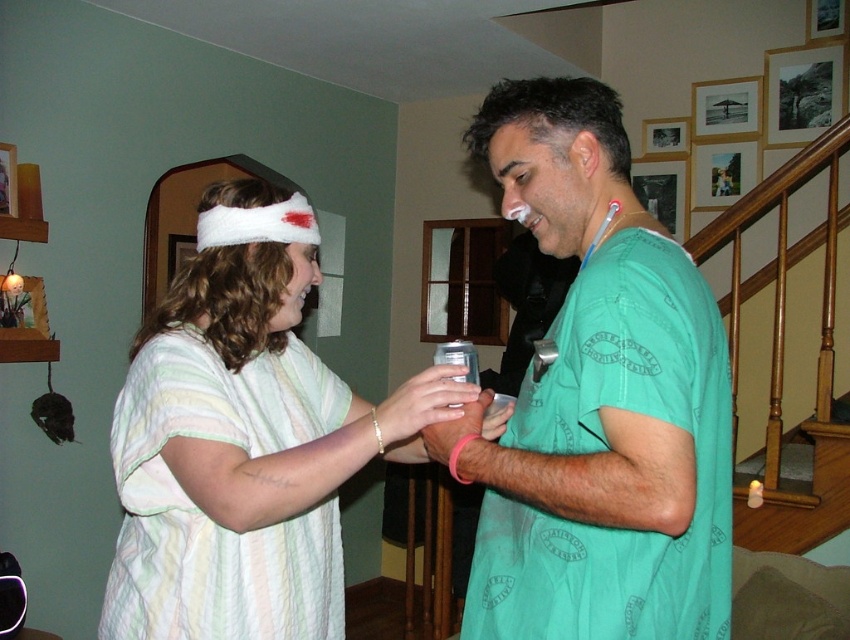
Is green fabric shirt at center smaller than white fluffy headband at upper left?

Yes.

Who is lower down, green fabric shirt at center or white fluffy headband at upper left?

white fluffy headband at upper left is below.

Measure the distance between point (615,442) and camera.

A distance of 1.02 meters exists between point (615,442) and camera.

Where is `green fabric shirt at center`? green fabric shirt at center is located at coordinates (598, 401).